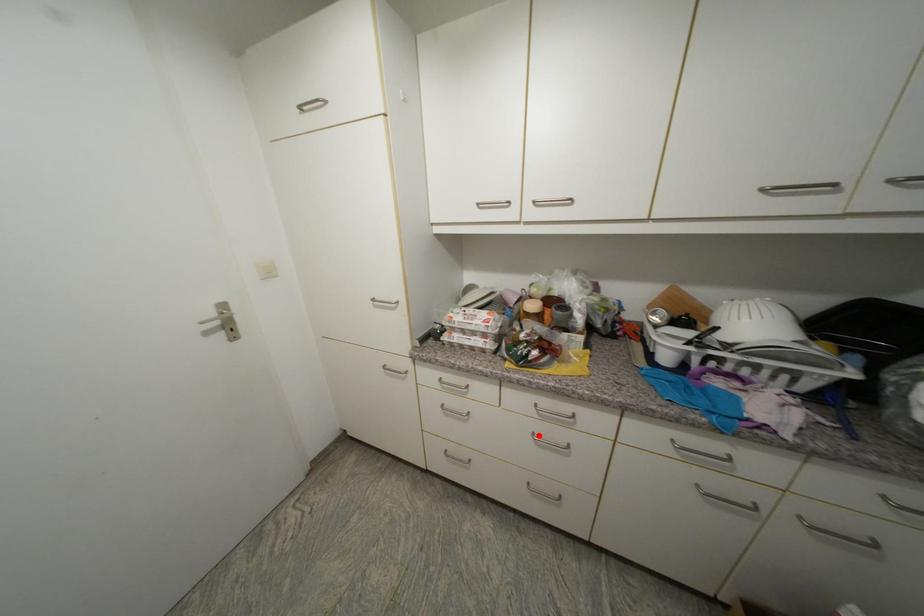
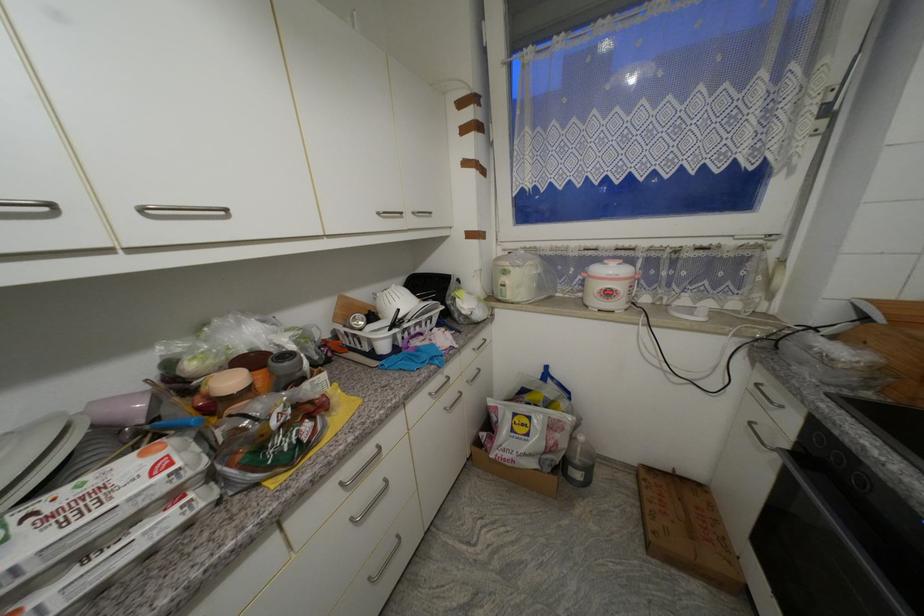
Question: I am providing you with two images of the same scene from different viewpoints. In image1, a red point is highlighted. Considering the same 3D point in image2, which of the following is correct?

Choices:
 (A) It is closer
 (B) It is farther

Answer: (A)